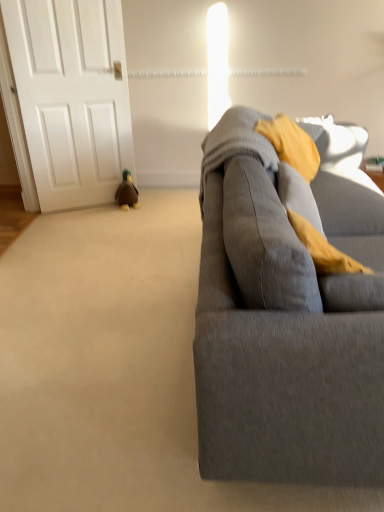
Question: Is white matte door at left at the left side of gray fabric couch at right?

Choices:
 (A) yes
 (B) no

Answer: (A)

Question: Is white matte door at left oriented away from gray fabric couch at right?

Choices:
 (A) yes
 (B) no

Answer: (B)

Question: Is white matte door at left not inside gray fabric couch at right?

Choices:
 (A) yes
 (B) no

Answer: (A)

Question: Can you confirm if white matte door at left is wider than gray fabric couch at right?

Choices:
 (A) yes
 (B) no

Answer: (B)

Question: Is white matte door at left aimed at gray fabric couch at right?

Choices:
 (A) yes
 (B) no

Answer: (A)

Question: From a real-world perspective, is brown plush duck at lower left physically located above or below gray fabric couch at right?

Choices:
 (A) above
 (B) below

Answer: (B)

Question: Is brown plush duck at lower left wider or thinner than gray fabric couch at right?

Choices:
 (A) wide
 (B) thin

Answer: (B)

Question: Considering the positions of brown plush duck at lower left and gray fabric couch at right in the image, is brown plush duck at lower left taller or shorter than gray fabric couch at right?

Choices:
 (A) tall
 (B) short

Answer: (B)

Question: From the image's perspective, relative to gray fabric couch at right, is brown plush duck at lower left above or below?

Choices:
 (A) above
 (B) below

Answer: (A)

Question: Considering the positions of white matte door at left and brown plush duck at lower left in the image, is white matte door at left wider or thinner than brown plush duck at lower left?

Choices:
 (A) thin
 (B) wide

Answer: (A)

Question: From a real-world perspective, is white matte door at left physically located above or below brown plush duck at lower left?

Choices:
 (A) above
 (B) below

Answer: (A)

Question: From the image's perspective, is white matte door at left above or below brown plush duck at lower left?

Choices:
 (A) below
 (B) above

Answer: (B)

Question: Is white matte door at left taller or shorter than brown plush duck at lower left?

Choices:
 (A) short
 (B) tall

Answer: (B)

Question: Is gray fabric couch at right taller or shorter than brown plush duck at lower left?

Choices:
 (A) short
 (B) tall

Answer: (B)

Question: Is point (380, 281) closer or farther from the camera than point (120, 202)?

Choices:
 (A) farther
 (B) closer

Answer: (B)